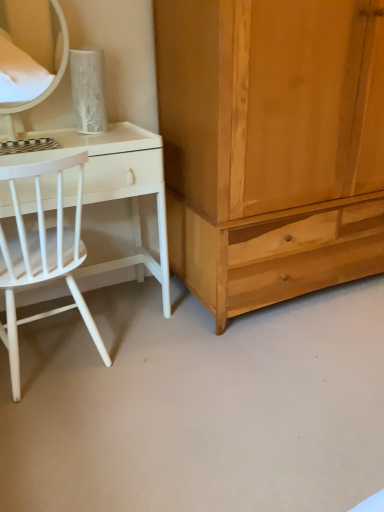
What is the approximate width of white matte wood chair at left?

white matte wood chair at left is 18.61 inches wide.

Measure the distance between point (12, 307) and camera.

A distance of 1.59 meters exists between point (12, 307) and camera.

Identify the location of light brown wood cabinet at right. (271, 145).

Do you think white matte wood chair at left is within light brown wood cabinet at right, or outside of it?

white matte wood chair at left is outside light brown wood cabinet at right.

Is white matte wood chair at left positioned with its back to light brown wood cabinet at right?

No, light brown wood cabinet at right is not at the back of white matte wood chair at left.

Which of these two, white matte wood chair at left or light brown wood cabinet at right, stands taller?

With more height is light brown wood cabinet at right.

Locate an element on the screen. This screenshot has width=384, height=512. mirror that is on the left side of light brown wood cabinet at right is located at coordinates (54, 76).

Considering the sizes of objects matte white mirror at upper left and light brown wood cabinet at right in the image provided, who is shorter, matte white mirror at upper left or light brown wood cabinet at right?

matte white mirror at upper left.

Considering the sizes of matte white mirror at upper left and light brown wood cabinet at right in the image, is matte white mirror at upper left wider or thinner than light brown wood cabinet at right?

Considering their sizes, matte white mirror at upper left looks slimmer than light brown wood cabinet at right.

Considering the sizes of objects white matte wood chair at left and white glossy desk at left in the image provided, who is thinner, white matte wood chair at left or white glossy desk at left?

With smaller width is white glossy desk at left.

Who is shorter, white matte wood chair at left or white glossy desk at left?

Standing shorter between the two is white glossy desk at left.

In the image, there is a white matte wood chair at left. Where is `desk below it (from a real-world perspective)`? The width and height of the screenshot is (384, 512). desk below it (from a real-world perspective) is located at coordinates [116, 195].

From the image's perspective, does white matte wood chair at left appear lower than white glossy desk at left?

Yes, from the image's perspective, white matte wood chair at left is below white glossy desk at left.

Considering the sizes of objects white glossy desk at left and light brown wood cabinet at right in the image provided, who is thinner, white glossy desk at left or light brown wood cabinet at right?

With smaller width is white glossy desk at left.

Which object is closer to the camera, white glossy desk at left or light brown wood cabinet at right?

Positioned in front is light brown wood cabinet at right.

Is white glossy desk at left spatially inside light brown wood cabinet at right, or outside of it?

white glossy desk at left is located beyond the bounds of light brown wood cabinet at right.

Is white glossy desk at left looking in the opposite direction of light brown wood cabinet at right?

No, white glossy desk at left is not facing the opposite direction of light brown wood cabinet at right.

Which is in front, matte white mirror at upper left or white matte wood chair at left?

white matte wood chair at left is in front.

Based on the photo, between matte white mirror at upper left and white matte wood chair at left, which one has more height?

With more height is white matte wood chair at left.

Is matte white mirror at upper left looking in the opposite direction of white matte wood chair at left?

No, matte white mirror at upper left is not facing away from white matte wood chair at left.

You are a GUI agent. You are given a task and a screenshot of the screen. Output one action in this format:
    pyautogui.click(x=<x>, y=<y>)
    Task: Click on the chair located below the matte white mirror at upper left (from the image's perspective)
    The height and width of the screenshot is (512, 384).
    Given the screenshot: What is the action you would take?
    pyautogui.click(x=42, y=257)

Locate an element on the screen. The width and height of the screenshot is (384, 512). mirror lying behind the light brown wood cabinet at right is located at coordinates (54, 76).

Does light brown wood cabinet at right contain matte white mirror at upper left?

That's incorrect, matte white mirror at upper left is not inside light brown wood cabinet at right.

Is light brown wood cabinet at right beside matte white mirror at upper left?

No, light brown wood cabinet at right is not touching matte white mirror at upper left.

Does light brown wood cabinet at right come in front of matte white mirror at upper left?

Yes.

From a real-world perspective, between matte white mirror at upper left and white glossy desk at left, who is vertically lower?

In real-world perspective, white glossy desk at left is lower.

Is matte white mirror at upper left not inside white glossy desk at left?

Yes, matte white mirror at upper left is not within white glossy desk at left.

From the image's perspective, is matte white mirror at upper left beneath white glossy desk at left?

No, from the image's perspective, matte white mirror at upper left is not below white glossy desk at left.

Is matte white mirror at upper left placed right next to white glossy desk at left?

matte white mirror at upper left and white glossy desk at left are clearly separated.

Identify the location of chair located underneath the light brown wood cabinet at right (from a real-world perspective). (42, 257).

Identify the location of mirror that appears above the light brown wood cabinet at right (from the image's perspective). point(54,76).

When comparing their distances from matte white mirror at upper left, does light brown wood cabinet at right or white glossy desk at left seem closer?

white glossy desk at left lies closer to matte white mirror at upper left than the other object.

Based on their spatial positions, is light brown wood cabinet at right or white glossy desk at left closer to white matte wood chair at left?

Among the two, white glossy desk at left is located nearer to white matte wood chair at left.

Estimate the real-world distances between objects in this image. Which object is further from matte white mirror at upper left, light brown wood cabinet at right or white matte wood chair at left?

light brown wood cabinet at right.

From the image, which object appears to be nearer to white matte wood chair at left, matte white mirror at upper left or white glossy desk at left?

Among the two, white glossy desk at left is located nearer to white matte wood chair at left.

Considering their positions, is white glossy desk at left positioned closer to matte white mirror at upper left than light brown wood cabinet at right?

Based on the image, white glossy desk at left appears to be nearer to matte white mirror at upper left.

Estimate the real-world distances between objects in this image. Which object is further from light brown wood cabinet at right, white matte wood chair at left or matte white mirror at upper left?

matte white mirror at upper left is further to light brown wood cabinet at right.

Based on their spatial positions, is white glossy desk at left or white matte wood chair at left closer to light brown wood cabinet at right?

Among the two, white glossy desk at left is located nearer to light brown wood cabinet at right.

Which object lies further to the anchor point white glossy desk at left, white matte wood chair at left or light brown wood cabinet at right?

The object further to white glossy desk at left is light brown wood cabinet at right.

The width and height of the screenshot is (384, 512). Identify the location of chair between matte white mirror at upper left and light brown wood cabinet at right. (42, 257).

Where is `desk situated between matte white mirror at upper left and light brown wood cabinet at right from left to right`? The width and height of the screenshot is (384, 512). desk situated between matte white mirror at upper left and light brown wood cabinet at right from left to right is located at coordinates (116, 195).

The image size is (384, 512). In order to click on desk between matte white mirror at upper left and white matte wood chair at left from top to bottom in this screenshot , I will do `click(116, 195)`.

Where is `desk between white matte wood chair at left and light brown wood cabinet at right from left to right`? This screenshot has width=384, height=512. desk between white matte wood chair at left and light brown wood cabinet at right from left to right is located at coordinates (116, 195).